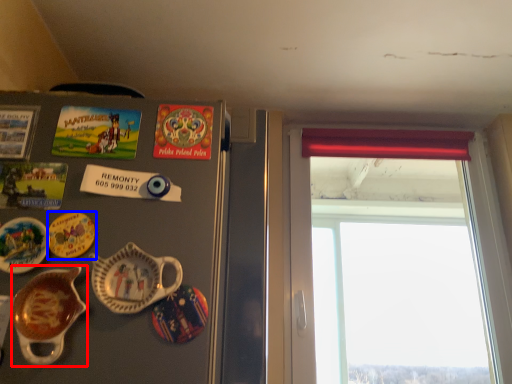
Question: Which point is further to the camera, tableware (highlighted by a red box) or plate (highlighted by a blue box)?

Choices:
 (A) tableware
 (B) plate

Answer: (B)